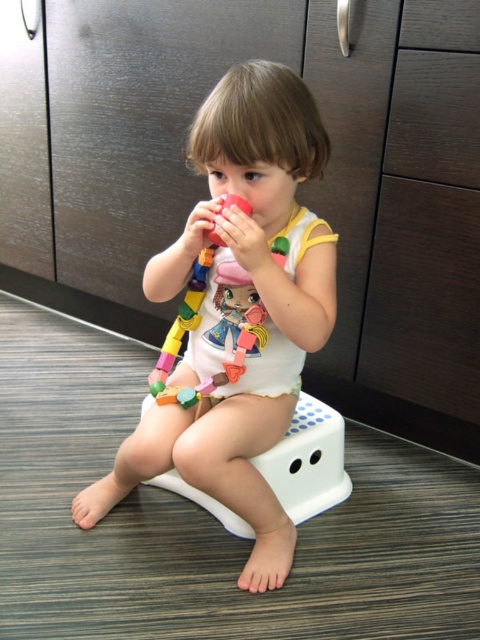
Question: Can you confirm if white matte onesie at center is positioned to the right of wooden blocks at center?

Choices:
 (A) no
 (B) yes

Answer: (B)

Question: Is white matte onesie at center to the right of wooden blocks at center from the viewer's perspective?

Choices:
 (A) yes
 (B) no

Answer: (A)

Question: Can you confirm if white matte onesie at center is smaller than wooden blocks at center?

Choices:
 (A) no
 (B) yes

Answer: (A)

Question: Which point is closer to the camera taking this photo?

Choices:
 (A) (273, 161)
 (B) (225, 198)

Answer: (A)

Question: Which point is farther to the camera?

Choices:
 (A) (208, 461)
 (B) (197, 296)

Answer: (B)